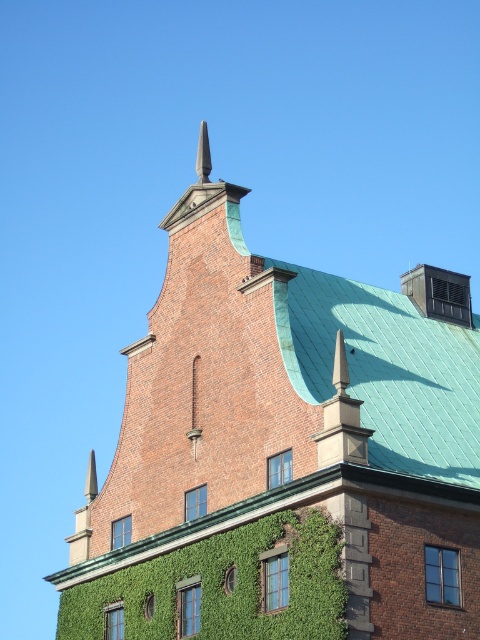
You are a window washer standing on the ground looking up at the brick tower at center and the green ivy at center. Which object do you need to climb higher to clean?

The brick tower at center is taller than the green ivy at center, so you need to climb higher to clean the brick tower at center.

You are an architect assessing the building facade. You need to install a decorative light strip along the widest object at the center. Which object should you choose between the brick tower at center and the green ivy at center?

The brick tower at center is wider than the green ivy at center, so you should install the decorative light strip along the brick tower at center.

You are standing in front of a building with a red brick facade and a green copper roof. You see a point marked at coordinates (284, 452). What is located at that point?

The point at (284, 452) indicates the location of the brick tower at center.